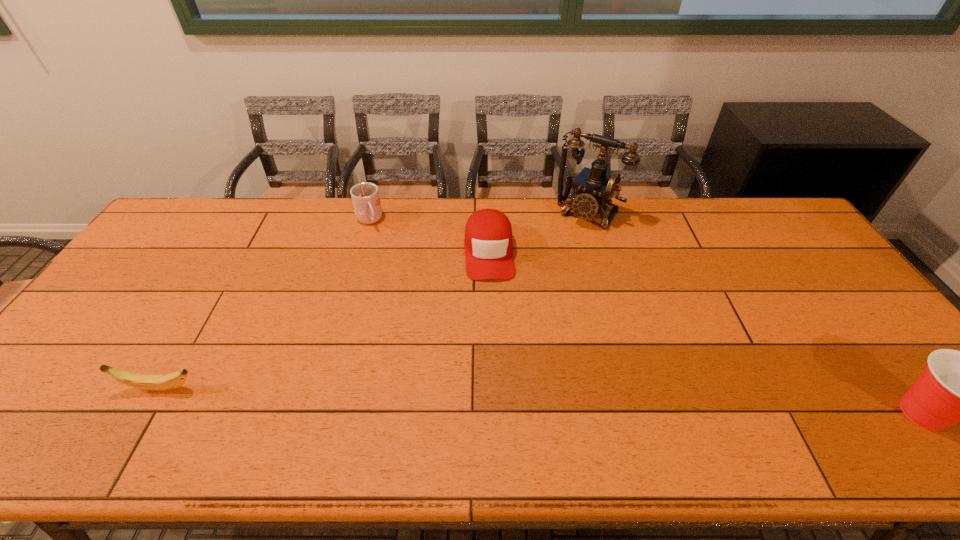
Identify the location of vacant area that lies between the third object from left to right and the second object from left to right. (429, 236).

This screenshot has width=960, height=540. Identify the location of object that is the third closest one to the second object from left to right. (163, 382).

Locate which object ranks fourth in proximity to the third object from left to right. Please provide its 2D coordinates. Your answer should be formatted as a tuple, i.e. [(x, y)], where the tuple contains the x and y coordinates of a point satisfying the conditions above.

[(956, 386)]